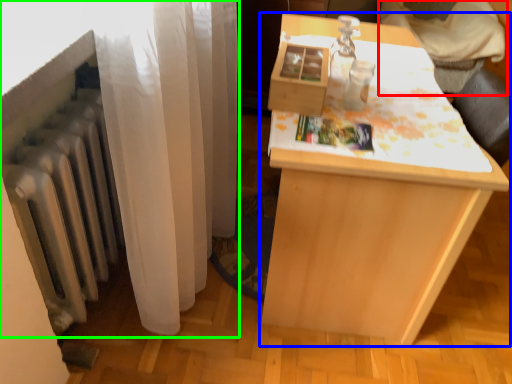
Question: Based on their relative distances, which object is farther from furniture (highlighted by a red box)? Choose from table (highlighted by a blue box) and curtain (highlighted by a green box).

Choices:
 (A) table
 (B) curtain

Answer: (B)